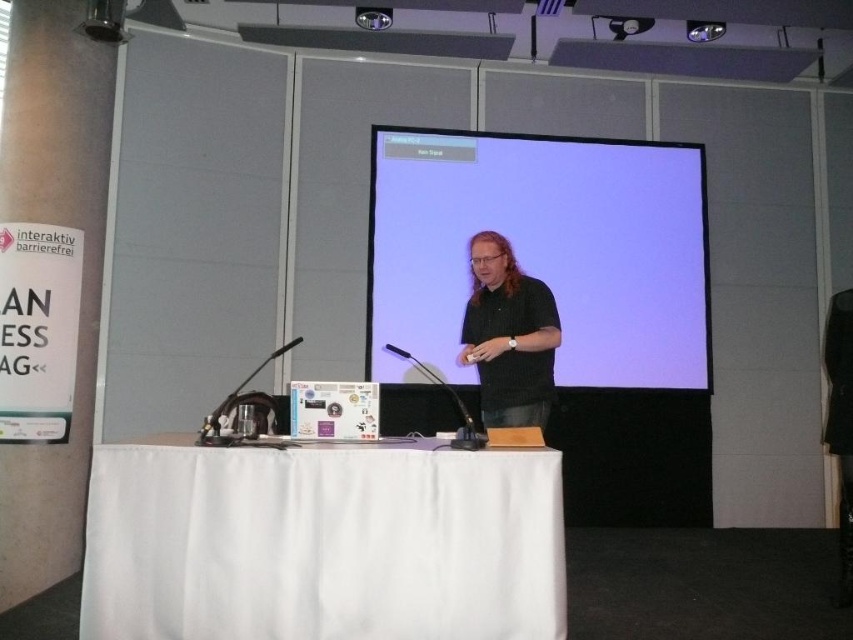
Question: Which of the following is the closest to the observer?

Choices:
 (A) (508, 404)
 (B) (106, 454)

Answer: (B)

Question: Can you confirm if white fabric table at center is positioned below black matte shirt at center?

Choices:
 (A) yes
 (B) no

Answer: (A)

Question: Is white fabric table at center closer to camera compared to black matte shirt at center?

Choices:
 (A) no
 (B) yes

Answer: (B)

Question: Among these objects, which one is farthest from the camera?

Choices:
 (A) matte black screen at center
 (B) black matte shirt at center
 (C) white fabric table at center

Answer: (A)

Question: Which point is closer to the camera?

Choices:
 (A) matte black screen at center
 (B) black matte shirt at center

Answer: (B)

Question: Is matte black screen at center positioned in front of black matte shirt at center?

Choices:
 (A) yes
 (B) no

Answer: (B)